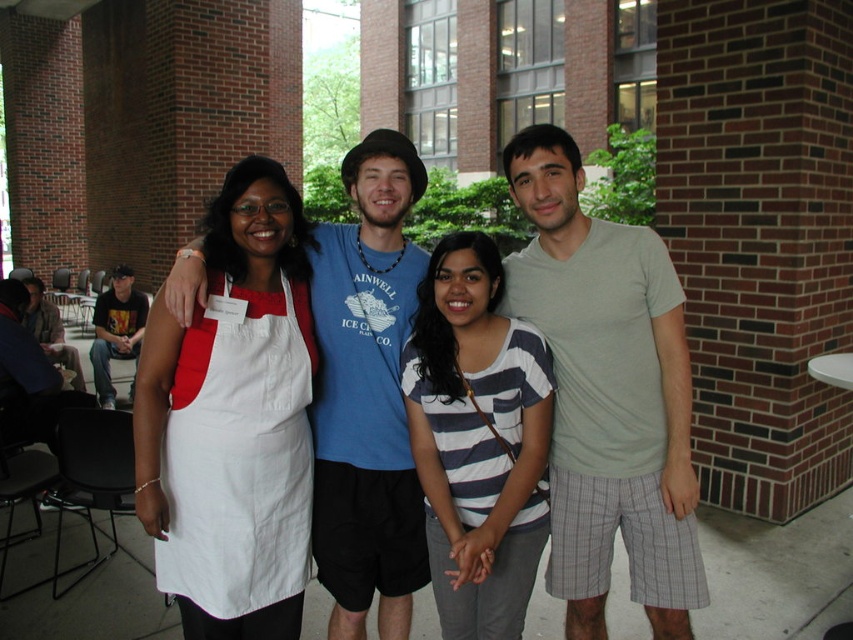
You are standing at the point labeled as point (x=556, y=348). You want to throw a ball to a friend who is standing 2 meters away from you. Is your friend within reach?

The distance between point (x=556, y=348) and the viewer is 2.26 meters, so the friend is slightly out of reach since they are 2.26 meters away, which is more than 2 meters.